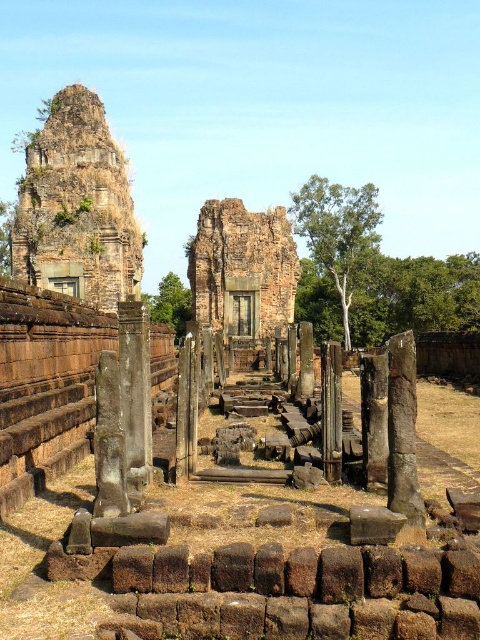
You are an archaeologist exploring the ancient temple complex. You notice a point marked at coordinates (242,268). What does this point indicate in the scene?

The point at coordinates (242,268) marks the location of brown stone ruins at the center of the scene.

You are an archaeologist standing at the entrance of the ancient temple complex. You see two points marked in the scene, one at point coordinates (216,208) and the other at (147,410). Which point is closer to your current position?

Point coordinates (216,208) is further to the camera than point coordinates (147,410), so the point at (147,410) is closer to your current position.